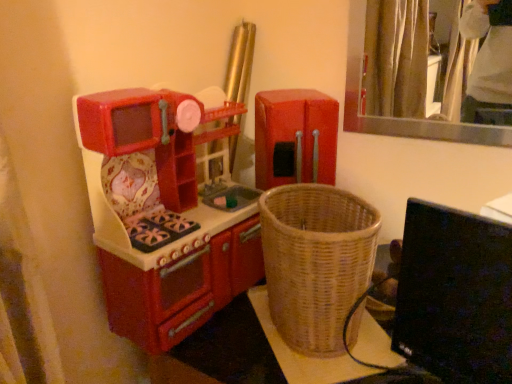
The width and height of the screenshot is (512, 384). Find the location of `free space above red plastic refrigerator at center, the second appliance in the left-to-right sequence (from a real-world perspective)`. free space above red plastic refrigerator at center, the second appliance in the left-to-right sequence (from a real-world perspective) is located at coordinates (294, 96).